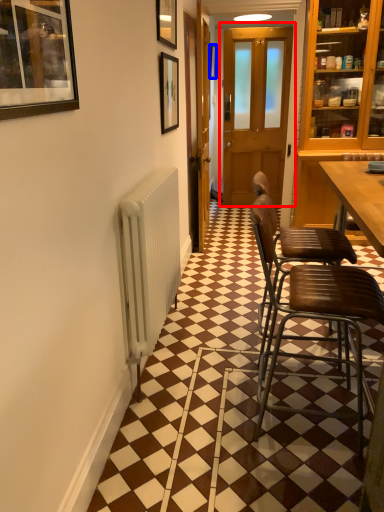
Question: Among these objects, which one is nearest to the camera, door (highlighted by a red box) or picture frame (highlighted by a blue box)?

Choices:
 (A) door
 (B) picture frame

Answer: (A)